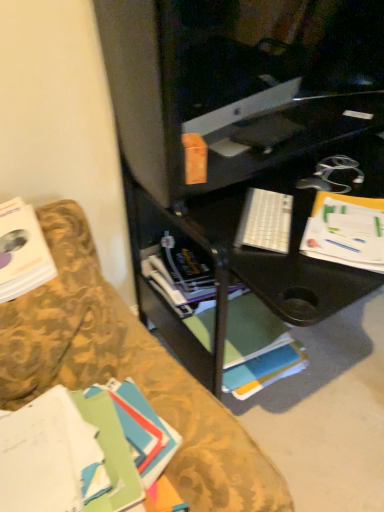
Question: From the image's perspective, is white paper book at left, marked as the 2th book in a back-to-front arrangement, above white plastic keyboard at center?

Choices:
 (A) yes
 (B) no

Answer: (B)

Question: From a real-world perspective, is white paper book at left, placed as the 2th book when sorted from front to back, physically above white plastic keyboard at center?

Choices:
 (A) no
 (B) yes

Answer: (B)

Question: Is white paper book at left, marked as the 2th book in a back-to-front arrangement, in contact with white plastic keyboard at center?

Choices:
 (A) yes
 (B) no

Answer: (B)

Question: Is white paper book at left, marked as the 2th book in a back-to-front arrangement, to the left of white plastic keyboard at center from the viewer's perspective?

Choices:
 (A) no
 (B) yes

Answer: (B)

Question: Is white paper book at left, placed as the 2th book when sorted from front to back, oriented towards white plastic keyboard at center?

Choices:
 (A) no
 (B) yes

Answer: (A)

Question: Is white plastic keyboard at center located within white paper book at left, marked as the 2th book in a back-to-front arrangement?

Choices:
 (A) no
 (B) yes

Answer: (A)

Question: From the image's perspective, would you say white paper at right is shown under white paper book at left, marked as the 2th book in a back-to-front arrangement?

Choices:
 (A) no
 (B) yes

Answer: (A)

Question: Is white paper at right behind white paper book at left, marked as the 2th book in a back-to-front arrangement?

Choices:
 (A) yes
 (B) no

Answer: (A)

Question: Is white paper at right turned away from white paper book at left, marked as the 2th book in a back-to-front arrangement?

Choices:
 (A) yes
 (B) no

Answer: (A)

Question: Is white paper at right aimed at white paper book at left, placed as the 2th book when sorted from front to back?

Choices:
 (A) yes
 (B) no

Answer: (B)

Question: Is white paper at right far away from white paper book at left, placed as the 2th book when sorted from front to back?

Choices:
 (A) no
 (B) yes

Answer: (A)

Question: Can you confirm if white paper at right is bigger than white paper book at left, placed as the 2th book when sorted from front to back?

Choices:
 (A) no
 (B) yes

Answer: (A)

Question: Does white paper book at left, marked as the 2th book in a back-to-front arrangement, have a lesser height compared to white paper at right?

Choices:
 (A) no
 (B) yes

Answer: (A)